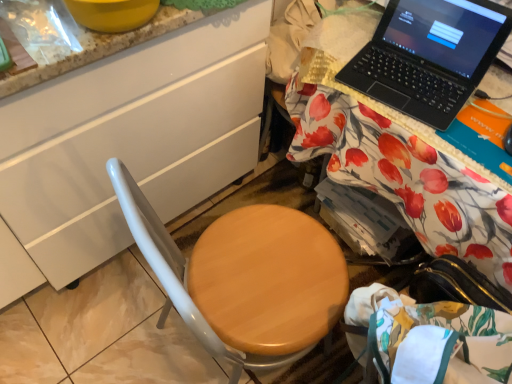
Question: From a real-world perspective, is black plastic laptop at upper right physically located above or below wooden at right?

Choices:
 (A) above
 (B) below

Answer: (A)

Question: Based on their positions, is black plastic laptop at upper right located to the left or right of wooden at right?

Choices:
 (A) right
 (B) left

Answer: (B)

Question: Estimate the real-world distances between objects in this image. Which object is closer to the white glossy cabinet at left?

Choices:
 (A) black plastic laptop at upper right
 (B) wooden at right

Answer: (B)

Question: Considering the real-world distances, which object is farthest from the wooden at right?

Choices:
 (A) white glossy cabinet at left
 (B) black plastic laptop at upper right

Answer: (A)